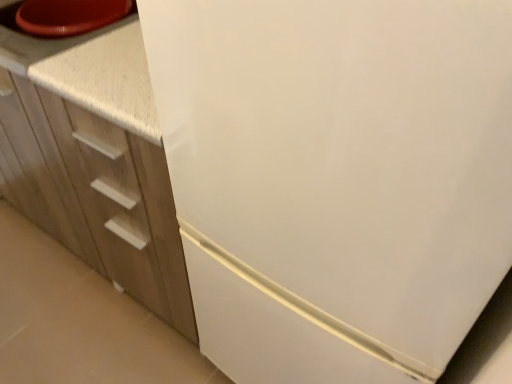
Image resolution: width=512 pixels, height=384 pixels. What do you see at coordinates (91, 72) in the screenshot? I see `white speckled countertop at upper left` at bounding box center [91, 72].

This screenshot has height=384, width=512. Identify the location of white speckled countertop at upper left. (91, 72).

What is the approximate width of white speckled countertop at upper left?

23.91 inches.

Looking at this image, what is the approximate height of white matte cabinet at left?

white matte cabinet at left is 33.57 inches tall.

The height and width of the screenshot is (384, 512). What do you see at coordinates (94, 158) in the screenshot?
I see `white matte cabinet at left` at bounding box center [94, 158].

I want to click on white matte cabinet at left, so click(x=94, y=158).

In order to face white matte cabinet at left, should I rotate leftwards or rightwards?

You should rotate left by 18.429 degrees.

I want to click on white speckled countertop at upper left, so click(x=91, y=72).

Is white speckled countertop at upper left at the right side of white matte cabinet at left?

In fact, white speckled countertop at upper left is to the left of white matte cabinet at left.

Who is more distant, white speckled countertop at upper left or white matte cabinet at left?

white speckled countertop at upper left is more distant.

Is point (20, 61) behind point (141, 102)?

Yes.

From the image's perspective, which object appears higher, white speckled countertop at upper left or white matte cabinet at left?

white speckled countertop at upper left appears higher in the image.

From a real-world perspective, relative to white matte cabinet at left, is white speckled countertop at upper left vertically above or below?

white speckled countertop at upper left is above white matte cabinet at left.

Can you confirm if white speckled countertop at upper left is wider than white matte cabinet at left?

Incorrect, the width of white speckled countertop at upper left does not surpass that of white matte cabinet at left.

Does white speckled countertop at upper left have a greater height compared to white matte cabinet at left?

Incorrect, the height of white speckled countertop at upper left is not larger of that of white matte cabinet at left.

Can you confirm if white speckled countertop at upper left is bigger than white matte cabinet at left?

Incorrect, white speckled countertop at upper left is not larger than white matte cabinet at left.

Which is correct: white speckled countertop at upper left is inside white matte cabinet at left, or outside of it?

white speckled countertop at upper left exists entirely within white matte cabinet at left.

From the picture: Is white speckled countertop at upper left next to white matte cabinet at left?

No, white speckled countertop at upper left is not making contact with white matte cabinet at left.

Is white speckled countertop at upper left oriented towards white matte cabinet at left?

Yes.

Can you tell me how much white speckled countertop at upper left and white matte cabinet at left differ in facing direction?

0.206 degrees separate the facing orientations of white speckled countertop at upper left and white matte cabinet at left.

Locate an element on the screen. The height and width of the screenshot is (384, 512). cabinetry in front of the white speckled countertop at upper left is located at coordinates (94, 158).

From the picture: Is white matte cabinet at left to the left of white speckled countertop at upper left from the viewer's perspective?

Incorrect, white matte cabinet at left is not on the left side of white speckled countertop at upper left.

Is white matte cabinet at left positioned behind white speckled countertop at upper left?

No, it is not.

Does point (75, 54) lie in front of point (117, 78)?

No, it is behind (117, 78).

From the image's perspective, which one is positioned higher, white matte cabinet at left or white speckled countertop at upper left?

white speckled countertop at upper left.

From a real-world perspective, between white matte cabinet at left and white speckled countertop at upper left, who is vertically lower?

white matte cabinet at left is physically lower.

Considering the relative sizes of white matte cabinet at left and white speckled countertop at upper left in the image provided, is white matte cabinet at left thinner than white speckled countertop at upper left?

No, white matte cabinet at left is not thinner than white speckled countertop at upper left.

Which of these two, white matte cabinet at left or white speckled countertop at upper left, stands taller?

white matte cabinet at left is taller.

Based on their sizes in the image, would you say white matte cabinet at left is bigger or smaller than white speckled countertop at upper left?

In the image, white matte cabinet at left appears to be larger than white speckled countertop at upper left.

Could white speckled countertop at upper left be considered to be inside white matte cabinet at left?

Yes.

Is white matte cabinet at left beside white speckled countertop at upper left?

No, white matte cabinet at left is not beside white speckled countertop at upper left.

Is white matte cabinet at left turned away from white speckled countertop at upper left?

No.

How different are the orientations of white matte cabinet at left and white speckled countertop at upper left in degrees?

They differ by 0.206 degrees in their facing directions.

The height and width of the screenshot is (384, 512). I want to click on counter top that is on the left side of white matte cabinet at left, so click(91, 72).

Where is `counter top on the left of the white matte cabinet at left`? This screenshot has height=384, width=512. counter top on the left of the white matte cabinet at left is located at coordinates (91, 72).

What are the coordinates of `counter top lying above the white matte cabinet at left (from the image's perspective)` in the screenshot? It's located at (91, 72).